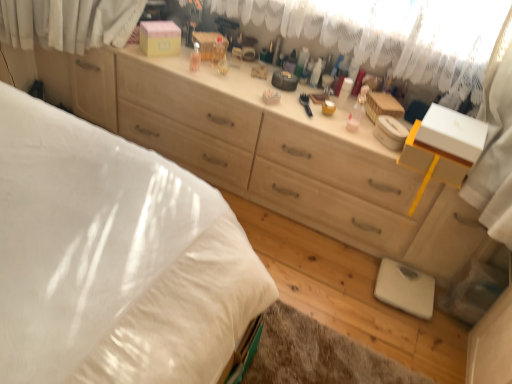
In order to click on vacant space in front of white plastic container at center, placed as the 2th toiletry when sorted from left to right in this screenshot , I will do `click(307, 96)`.